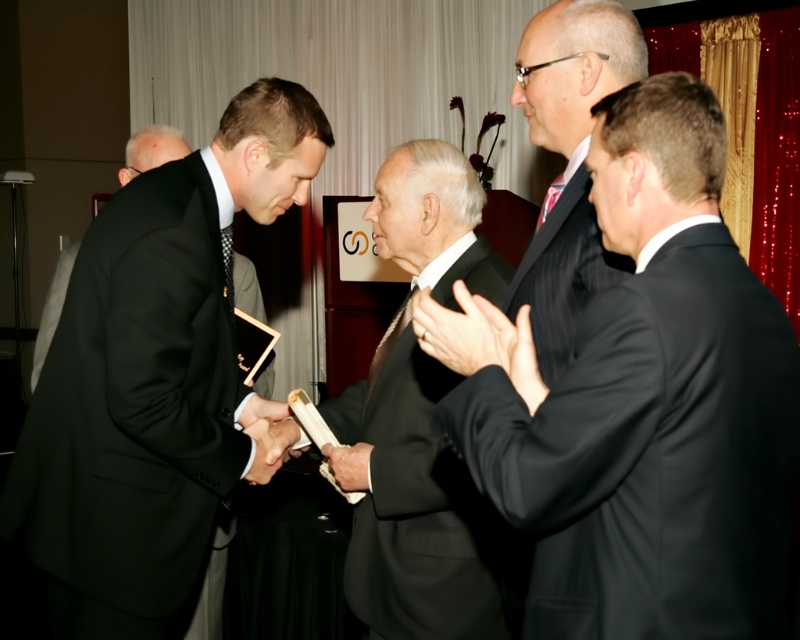
Question: Which is farther from the matte black suit at center?

Choices:
 (A) smooth leather hand at center
 (B) black pinstripe suit at right
 (C) black leather hand at center

Answer: (B)

Question: Can you confirm if black pinstripe suit at right is smaller than smooth leather hand at center?

Choices:
 (A) no
 (B) yes

Answer: (A)

Question: Does black satin suit at left appear over black leather hand at center?

Choices:
 (A) yes
 (B) no

Answer: (A)

Question: Which is nearer to the smooth black glove at center?

Choices:
 (A) smooth leather hand at center
 (B) black satin suit at left
 (C) pinstripe dark suit at right

Answer: (B)

Question: Can you confirm if black satin suit at left is positioned to the left of matte black suit at center?

Choices:
 (A) no
 (B) yes

Answer: (B)

Question: Which object is positioned closest to the smooth leather hand at center?

Choices:
 (A) black pinstripe suit at right
 (B) pinstripe dark suit at right
 (C) black satin suit at left

Answer: (B)